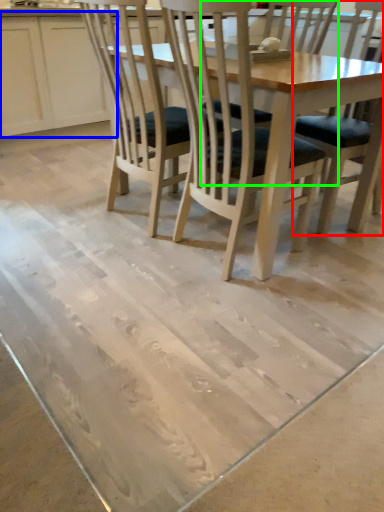
Question: Which object is positioned farthest from chair (highlighted by a red box)? Select from cabinetry (highlighted by a blue box) and chair (highlighted by a green box).

Choices:
 (A) cabinetry
 (B) chair

Answer: (A)